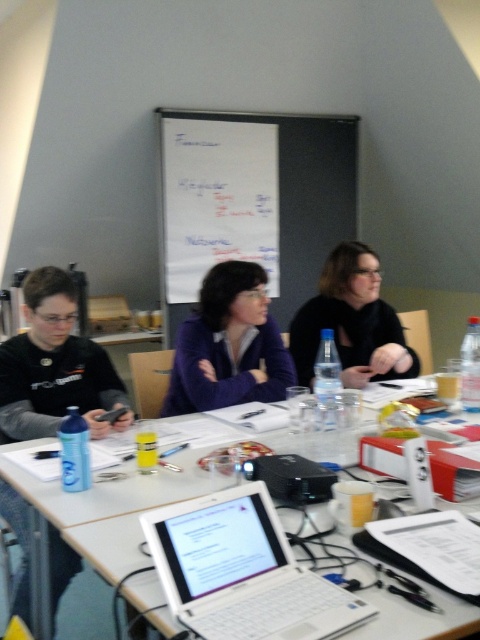
Question: Can you confirm if matte black shirt at left is wider than white plastic table at center?

Choices:
 (A) yes
 (B) no

Answer: (B)

Question: Among these points, which one is farthest from the camera?

Choices:
 (A) (17, 438)
 (B) (351, 298)
 (C) (32, 480)
 (D) (256, 548)

Answer: (B)

Question: Which point is closer to the camera?

Choices:
 (A) (120, 490)
 (B) (282, 538)
 (C) (33, 358)

Answer: (B)

Question: From the image, what is the correct spatial relationship of purple sweater at center in relation to black matte jacket at center?

Choices:
 (A) below
 (B) above

Answer: (A)

Question: Among these objects, which one is nearest to the camera?

Choices:
 (A) white plastic laptop at center
 (B) black matte jacket at center
 (C) white plastic table at center

Answer: (A)

Question: Is the position of matte black shirt at left less distant than that of black matte jacket at center?

Choices:
 (A) yes
 (B) no

Answer: (A)